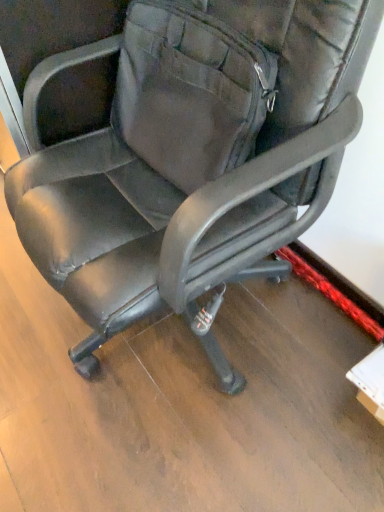
Describe the element at coordinates (190, 91) in the screenshot. I see `camouflage fabric messenger bag at center` at that location.

From the picture: Measure the distance between point (x=194, y=126) and camera.

The depth of point (x=194, y=126) is 34.41 inches.

At what (x,y) coordinates should I click in order to perform the action: click on camouflage fabric messenger bag at center. Please return your answer as a coordinate pair (x, y). Looking at the image, I should click on (190, 91).

This screenshot has height=512, width=384. Find the location of `camouflage fabric messenger bag at center`. camouflage fabric messenger bag at center is located at coordinates (190, 91).